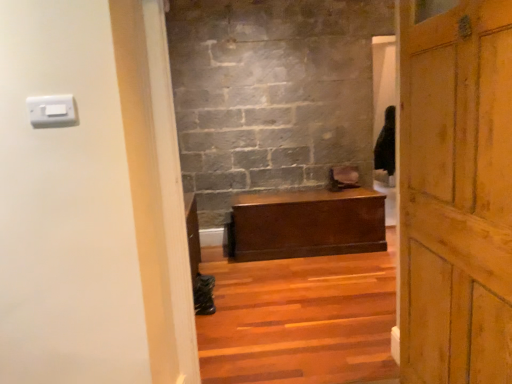
What do you see at coordinates (306, 224) in the screenshot?
I see `matte brown wooden chest at center` at bounding box center [306, 224].

Where is `wooden door at right`? wooden door at right is located at coordinates (455, 191).

Who is shorter, wooden stairs at center or wooden door at right?

wooden stairs at center is shorter.

Considering the sizes of objects wooden stairs at center and wooden door at right in the image provided, who is thinner, wooden stairs at center or wooden door at right?

wooden door at right.

Does wooden stairs at center come behind wooden door at right?

Yes, it is behind wooden door at right.

Is wooden door at right inside wooden stairs at center?

No.

From the image's perspective, is matte brown wooden chest at center located above wooden door at right?

No, from the image's perspective, matte brown wooden chest at center is not over wooden door at right.

Which object is further away from the camera taking this photo, matte brown wooden chest at center or wooden door at right?

matte brown wooden chest at center is further away from the camera.

Find the location of a particular element. This screenshot has height=384, width=512. table above the wooden stairs at center (from a real-world perspective) is located at coordinates (306, 224).

From a real-world perspective, is wooden stairs at center on matte brown wooden chest at center?

No, from a real-world perspective, wooden stairs at center is not over matte brown wooden chest at center

Is wooden stairs at center turned away from matte brown wooden chest at center?

No.

In the scene shown: Which of these two, matte brown wooden chest at center or wooden stairs at center, stands taller?

matte brown wooden chest at center.

Considering the sizes of objects matte brown wooden chest at center and wooden stairs at center in the image provided, who is smaller, matte brown wooden chest at center or wooden stairs at center?

matte brown wooden chest at center.

From a real-world perspective, is matte brown wooden chest at center physically below wooden stairs at center?

No, from a real-world perspective, matte brown wooden chest at center is not under wooden stairs at center.

Does white plastic light switch at upper left come behind wooden door at right?

Yes, white plastic light switch at upper left is behind wooden door at right.

From a real-world perspective, is white plastic light switch at upper left physically below wooden door at right?

Incorrect, from a real-world perspective, white plastic light switch at upper left is higher than wooden door at right.

Is white plastic light switch at upper left not near wooden door at right?

That's right, there is a large distance between white plastic light switch at upper left and wooden door at right.

Where is `door in front of the white plastic light switch at upper left`? The width and height of the screenshot is (512, 384). door in front of the white plastic light switch at upper left is located at coordinates (455, 191).

In the scene shown: Is wooden door at right next to matte brown wooden chest at center?

wooden door at right is not next to matte brown wooden chest at center, and they're not touching.

From the picture: Is wooden door at right shorter than matte brown wooden chest at center?

Incorrect, the height of wooden door at right does not fall short of that of matte brown wooden chest at center.

Who is bigger, wooden door at right or matte brown wooden chest at center?

Bigger between the two is matte brown wooden chest at center.

Can you confirm if white plastic light switch at upper left is wider than wooden stairs at center?

No, white plastic light switch at upper left is not wider than wooden stairs at center.

Is wooden stairs at center located within white plastic light switch at upper left?

That's incorrect, wooden stairs at center is not inside white plastic light switch at upper left.

Considering the points (32, 113) and (253, 354), which point is behind, point (32, 113) or point (253, 354)?

The point (253, 354) is farther from the camera.

Find the location of `stairs that appears behind the wooden door at right`. stairs that appears behind the wooden door at right is located at coordinates (300, 320).

Identify the location of table on the right of wooden door at right. (306, 224).

Estimate the real-world distances between objects in this image. Which object is further from wooden door at right, matte brown wooden chest at center or wooden stairs at center?

matte brown wooden chest at center is positioned further to the anchor wooden door at right.

Which object lies nearer to the anchor point white plastic light switch at upper left, wooden stairs at center or matte brown wooden chest at center?

wooden stairs at center.

From the image, which object appears to be nearer to wooden door at right, matte brown wooden chest at center or white plastic light switch at upper left?

The object closer to wooden door at right is white plastic light switch at upper left.

Estimate the real-world distances between objects in this image. Which object is closer to wooden door at right, white plastic light switch at upper left or wooden stairs at center?

The object closer to wooden door at right is wooden stairs at center.

When comparing their distances from wooden stairs at center, does matte brown wooden chest at center or wooden door at right seem closer?

Among the two, matte brown wooden chest at center is located nearer to wooden stairs at center.

Estimate the real-world distances between objects in this image. Which object is further from wooden stairs at center, white plastic light switch at upper left or wooden door at right?

Based on the image, white plastic light switch at upper left appears to be further to wooden stairs at center.

Looking at the image, which one is located further to white plastic light switch at upper left, wooden door at right or wooden stairs at center?

wooden stairs at center is positioned further to the anchor white plastic light switch at upper left.

Looking at the image, which one is located further to white plastic light switch at upper left, matte brown wooden chest at center or wooden stairs at center?

The object further to white plastic light switch at upper left is matte brown wooden chest at center.

Find the location of `light switch between wooden door at right and matte brown wooden chest at center from front to back`. light switch between wooden door at right and matte brown wooden chest at center from front to back is located at coordinates (52, 111).

You are a GUI agent. You are given a task and a screenshot of the screen. Output one action in this format:
    pyautogui.click(x=<x>, y=<y>)
    Task: Click on the stairs between wooden door at right and matte brown wooden chest at center in the front-back direction
    The image size is (512, 384).
    Given the screenshot: What is the action you would take?
    pyautogui.click(x=300, y=320)

I want to click on stairs between white plastic light switch at upper left and wooden door at right, so click(x=300, y=320).

In order to click on stairs positioned between white plastic light switch at upper left and matte brown wooden chest at center from near to far in this screenshot , I will do `click(300, 320)`.